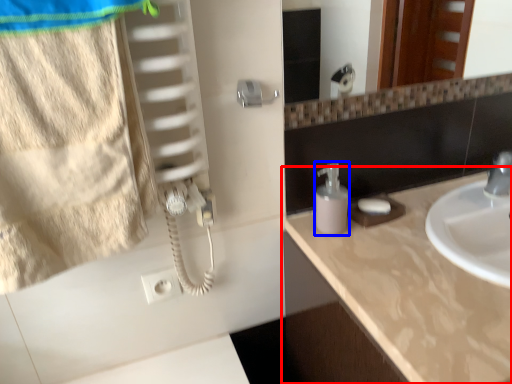
Question: Which point is further to the camera, countertop (highlighted by a red box) or soap dispenser (highlighted by a blue box)?

Choices:
 (A) countertop
 (B) soap dispenser

Answer: (B)